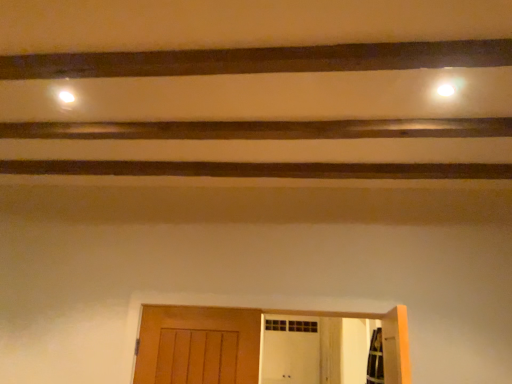
Question: Considering the positions of point pyautogui.click(x=210, y=329) and point pyautogui.click(x=465, y=44), is point pyautogui.click(x=210, y=329) closer or farther from the camera than point pyautogui.click(x=465, y=44)?

Choices:
 (A) farther
 (B) closer

Answer: (A)

Question: Is wooden door at lower center inside or outside of brown wooden plank at upper center?

Choices:
 (A) inside
 (B) outside

Answer: (B)

Question: Considering the positions of wooden door at lower center and brown wooden plank at upper center in the image, is wooden door at lower center bigger or smaller than brown wooden plank at upper center?

Choices:
 (A) big
 (B) small

Answer: (A)

Question: Do you think brown wooden plank at upper center is within wooden door at lower center, or outside of it?

Choices:
 (A) outside
 (B) inside

Answer: (A)

Question: Relative to wooden door at lower center, is brown wooden plank at upper center in front or behind?

Choices:
 (A) front
 (B) behind

Answer: (A)

Question: Is point (126, 54) closer or farther from the camera than point (194, 327)?

Choices:
 (A) farther
 (B) closer

Answer: (B)

Question: From a real-world perspective, is brown wooden plank at upper center positioned above or below wooden door at lower center?

Choices:
 (A) below
 (B) above

Answer: (B)